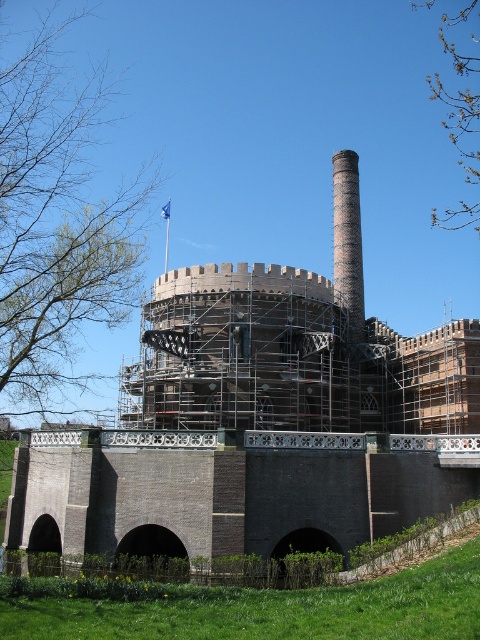
You are standing at the base of the historic structure and want to walk towards the bridge. There are two points marked on the image, point 1 at coordinates point [309,531] and point 2 at coordinates point [343,205]. Which point should you look towards first as you walk towards the bridge?

Point [309,531] is in front of point [343,205], so you should look towards point [309,531] first as you walk towards the bridge.

You are an architect inspecting the historic structure. You notice the brick scaffolding at center and the brick chimney at center. Which of these two objects is positioned lower in the image?

The brick scaffolding at center is located below the brick chimney at center, so it is positioned lower in the image.

You are an architect examining the renovation plans of the historic structure. The brick scaffolding at center is crucial for the restoration work. Based on its coordinates, can you determine if it is positioned closer to the front or the back of the building?

The brick scaffolding at center is positioned at coordinates point (x=250, y=432), which places it closer to the back of the building since the coordinate system typically measures from the bottom left corner, meaning higher x values indicate positions further to the right and higher y values indicate positions further up.